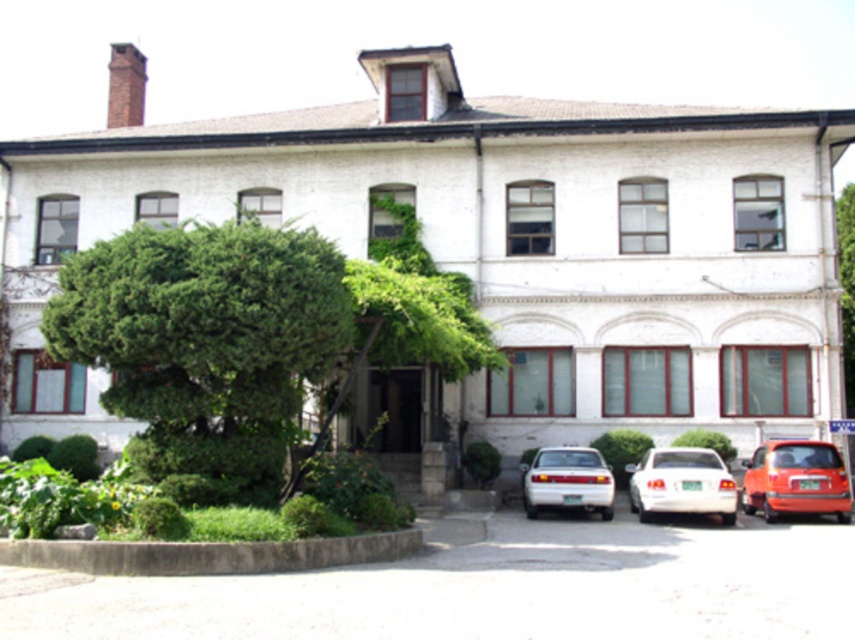
Who is lower down, white matte sedan at center or green leafy tree at center?

white matte sedan at center

Measure the distance between point (526,497) and camera.

A distance of 19.05 meters exists between point (526,497) and camera.

What are the coordinates of `white matte sedan at center` in the screenshot? It's located at (567, 481).

Does point (759, 483) come closer to viewer compared to point (688, 472)?

No.

From the picture: Measure the distance from shiny orange car at lower right to white glossy sedan at lower right.

shiny orange car at lower right and white glossy sedan at lower right are 1.71 meters apart.

Where is `shiny orange car at lower right`? The height and width of the screenshot is (640, 855). shiny orange car at lower right is located at coordinates (795, 480).

Is green leafy tree at left to the left of shiny orange car at lower right from the viewer's perspective?

Indeed, green leafy tree at left is positioned on the left side of shiny orange car at lower right.

Which of these two, green leafy tree at left or shiny orange car at lower right, stands taller?

shiny orange car at lower right is taller.

Does point (304, 355) come farther from viewer compared to point (826, 468)?

No, (304, 355) is in front of (826, 468).

Identify the location of green leafy tree at left. (205, 337).